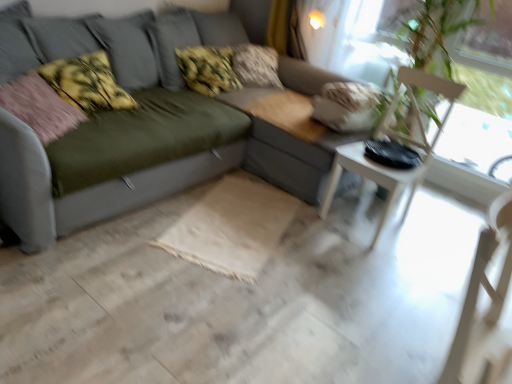
You are a GUI agent. You are given a task and a screenshot of the screen. Output one action in this format:
    pyautogui.click(x=<x>, y=<y>)
    Task: Click on the vacant area that lies between transparent glass window screen at upper right and white wood armchair at right, marked as the first armchair in a front-to-back arrangement
    
    Given the screenshot: What is the action you would take?
    pyautogui.click(x=401, y=280)